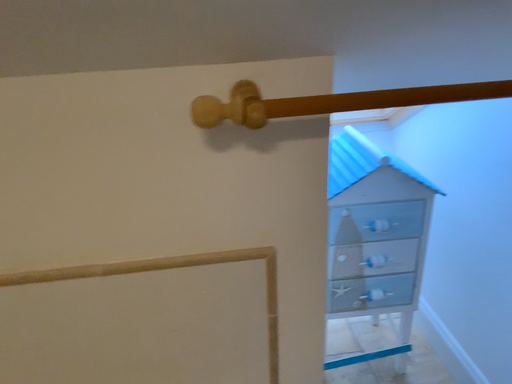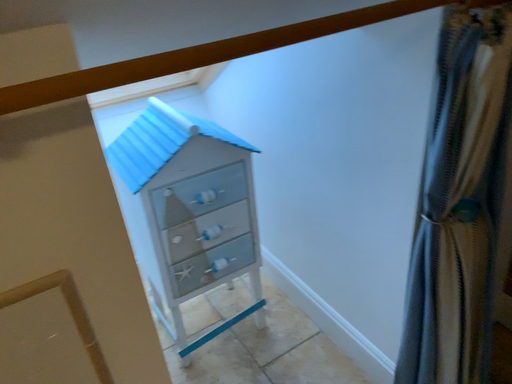
Question: How did the camera likely rotate when shooting the video?

Choices:
 (A) rotated left
 (B) rotated right

Answer: (B)